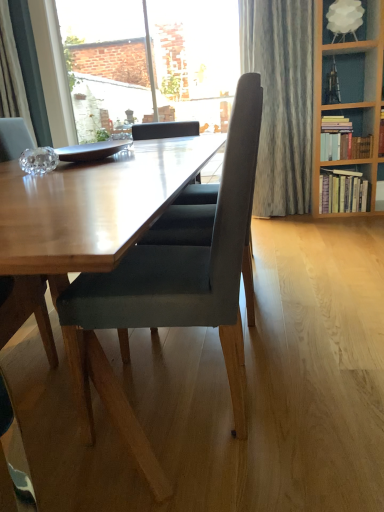
Identify the location of vacant location below hardcover books at upper right, which is counted as the first book, starting from the top (from a real-world perspective). The width and height of the screenshot is (384, 512). (342, 170).